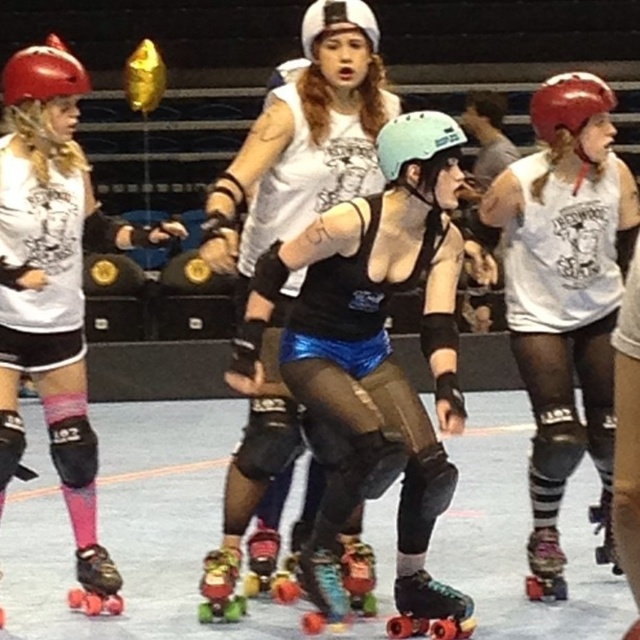
Question: Does matte white tank top at center have a smaller size compared to shiny red helmet at upper left?

Choices:
 (A) no
 (B) yes

Answer: (A)

Question: Is shiny blue shorts at center positioned in front of shiny black roller skate at lower left?

Choices:
 (A) no
 (B) yes

Answer: (B)

Question: Is black matte roller skate at center closer to the viewer compared to brushed metal roller skate at lower left?

Choices:
 (A) no
 (B) yes

Answer: (B)

Question: Which point is closer to the camera?

Choices:
 (A) shiny green roller skate at center
 (B) pink matte knee pads at lower left
 (C) white matte helmet at upper center
 (D) brushed metal roller skate at lower left

Answer: (B)

Question: Which point is closer to the camera taking this photo?

Choices:
 (A) (38, 260)
 (B) (51, 35)
 (C) (369, 22)
 (D) (413, 499)

Answer: (D)

Question: Which object appears closest to the camera in this image?

Choices:
 (A) shiny red helmet at upper left
 (B) black matte roller skate at center

Answer: (B)